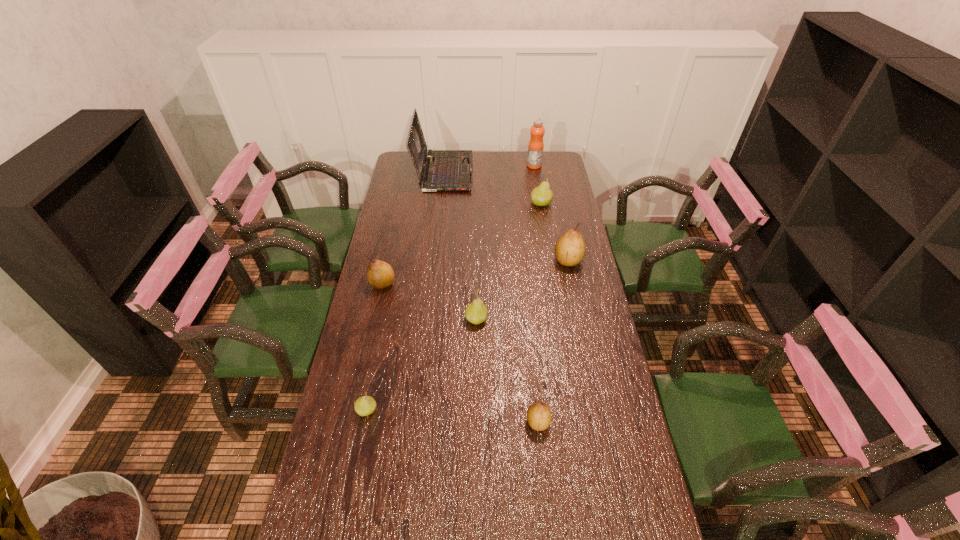
Where is `vacant space located on the left of the fourth pear from left to right`? This screenshot has height=540, width=960. vacant space located on the left of the fourth pear from left to right is located at coordinates click(x=390, y=422).

Where is `free space located on the right of the leftmost green pear`? This screenshot has height=540, width=960. free space located on the right of the leftmost green pear is located at coordinates (401, 410).

Locate an element on the screen. The height and width of the screenshot is (540, 960). laptop computer that is positioned at the far edge is located at coordinates (446, 170).

Locate an element on the screen. fruit juice present at the far edge is located at coordinates (536, 145).

You are a GUI agent. You are given a task and a screenshot of the screen. Output one action in this format:
    pyautogui.click(x=<x>, y=<y>)
    Task: Click on the laptop computer that is positioned at the left edge
    Image resolution: width=960 pixels, height=540 pixels.
    Given the screenshot: What is the action you would take?
    pyautogui.click(x=446, y=170)

The image size is (960, 540). Find the location of `fruit juice located in the right edge section of the desktop`. fruit juice located in the right edge section of the desktop is located at coordinates (536, 145).

You are a GUI agent. You are given a task and a screenshot of the screen. Output one action in this format:
    pyautogui.click(x=<x>, y=<y>)
    Task: Click on the object at the far left corner
    The width and height of the screenshot is (960, 540).
    Given the screenshot: What is the action you would take?
    pyautogui.click(x=446, y=170)

At what (x,y) coordinates should I click in order to perform the action: click on object present at the far right corner. Please return your answer as a coordinate pair (x, y). Looking at the image, I should click on (536, 145).

The image size is (960, 540). I want to click on free spot at the far edge of the desktop, so click(488, 167).

This screenshot has height=540, width=960. Find the location of `free space at the left edge of the desktop`. free space at the left edge of the desktop is located at coordinates (423, 200).